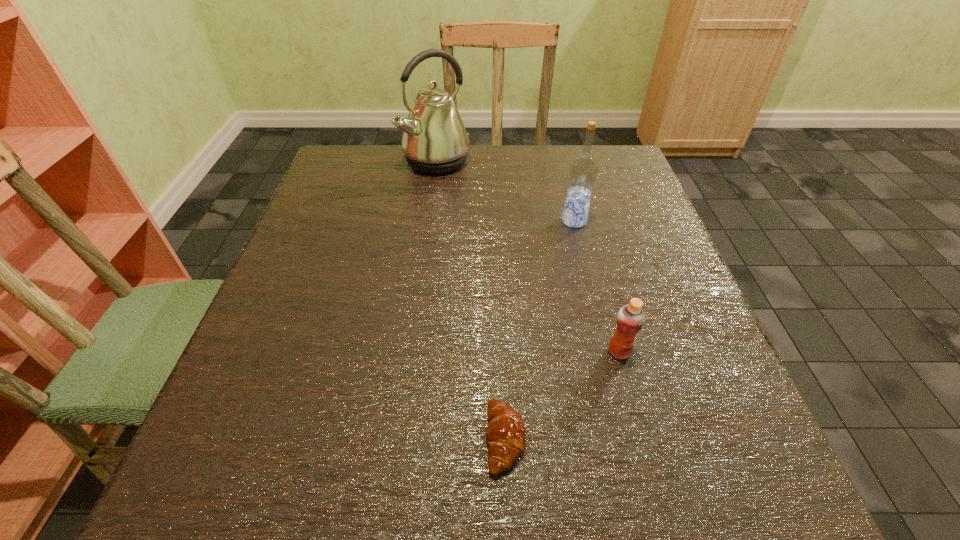
Identify the location of free space between the tallest object and the second farthest object. The height and width of the screenshot is (540, 960). (505, 191).

You are a GUI agent. You are given a task and a screenshot of the screen. Output one action in this format:
    pyautogui.click(x=<x>, y=<y>)
    Task: Click on the second closest object to the leftmost object
    
    Given the screenshot: What is the action you would take?
    pyautogui.click(x=630, y=319)

Locate an element on the screen. Image resolution: width=960 pixels, height=540 pixels. the closest object to the tallest object is located at coordinates (583, 169).

This screenshot has width=960, height=540. Identify the location of vacant space that satisfies the following two spatial constraints: 1. on the front side of the orange juice; 2. on the right side of the vodka. (606, 352).

You are a GUI agent. You are given a task and a screenshot of the screen. Output one action in this format:
    pyautogui.click(x=<x>, y=<y>)
    Task: Click on the vacant space that satisfies the following two spatial constraints: 1. on the back side of the nearest object; 2. on the right side of the second farthest object
    The height and width of the screenshot is (540, 960).
    Given the screenshot: What is the action you would take?
    pyautogui.click(x=496, y=221)

The image size is (960, 540). What are the coordinates of `vacant area in the image that satisfies the following two spatial constraints: 1. on the back side of the nearest object; 2. on the left side of the third farthest object` in the screenshot? It's located at (502, 352).

Find the location of a particular element. The width and height of the screenshot is (960, 540). blank space that satisfies the following two spatial constraints: 1. on the back side of the third object from right to left; 2. on the right side of the vodka is located at coordinates (496, 221).